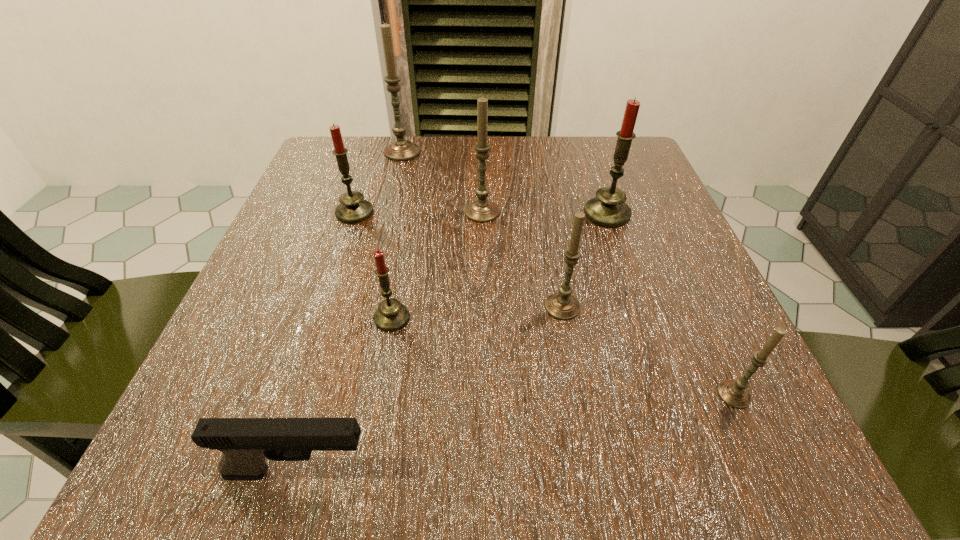
Locate an element on the screen. vacant point located between the smallest red candle and the third smallest gray candle is located at coordinates (437, 265).

The width and height of the screenshot is (960, 540). I want to click on free point between the third gray candle from right to left and the sixth candle from left to right, so click(544, 213).

Where is `free area in between the third smallest gray candle and the nearest candle`? The height and width of the screenshot is (540, 960). free area in between the third smallest gray candle and the nearest candle is located at coordinates point(608,303).

You are a GUI agent. You are given a task and a screenshot of the screen. Output one action in this format:
    pyautogui.click(x=<x>, y=<y>)
    Task: Click on the free space between the farthest candle and the sixth object from left to right
    
    Given the screenshot: What is the action you would take?
    pyautogui.click(x=482, y=230)

You are a GUI agent. You are given a task and a screenshot of the screen. Output one action in this format:
    pyautogui.click(x=<x>, y=<y>)
    Task: Click on the free area in between the farthest object and the nearest red candle
    This screenshot has width=960, height=540.
    Given the screenshot: What is the action you would take?
    pyautogui.click(x=397, y=235)

Locate an element on the screen. unoccupied position between the sixth candle from left to right and the shortest object is located at coordinates (453, 343).

Choose which object is the nearest neighbor to the rightmost gray candle. Please provide its 2D coordinates. Your answer should be formatted as a tuple, i.e. [(x, y)], where the tuple contains the x and y coordinates of a point satisfying the conditions above.

[(562, 305)]

Where is `object that is the fifth closest to the fifth object from left to right`? The height and width of the screenshot is (540, 960). object that is the fifth closest to the fifth object from left to right is located at coordinates (391, 315).

Point out which candle is positioned as the fifth nearest to the smallest red candle. Please provide its 2D coordinates. Your answer should be formatted as a tuple, i.e. [(x, y)], where the tuple contains the x and y coordinates of a point satisfying the conditions above.

[(734, 393)]

Image resolution: width=960 pixels, height=540 pixels. Find the location of `candle that stands as the sixth closest to the third farthest gray candle`. candle that stands as the sixth closest to the third farthest gray candle is located at coordinates (400, 150).